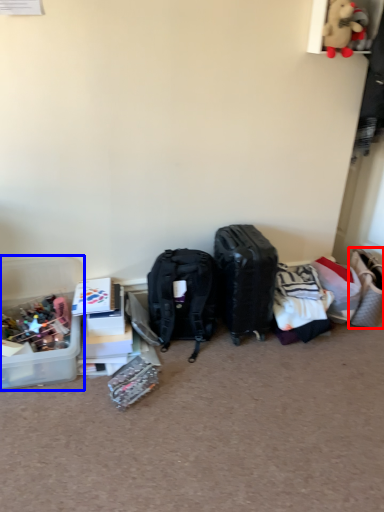
Question: Which object appears farthest to the camera in this image, handbag (highlighted by a red box) or box (highlighted by a blue box)?

Choices:
 (A) handbag
 (B) box

Answer: (A)